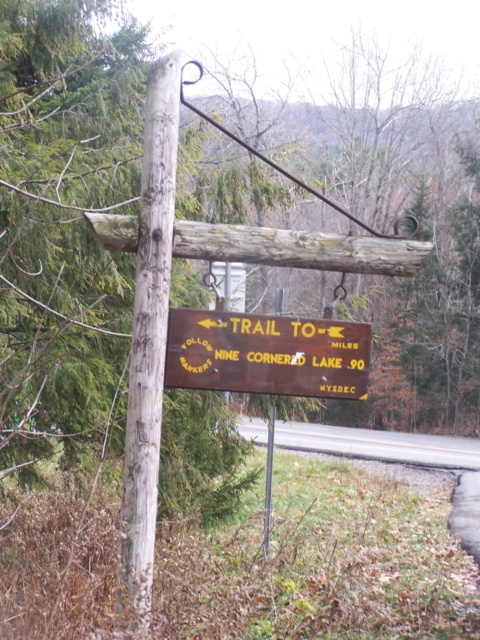
Question: Is weathered wood pole at center above brown wooden sign at center?

Choices:
 (A) yes
 (B) no

Answer: (A)

Question: Which object appears closest to the camera in this image?

Choices:
 (A) weathered wood pole at center
 (B) brown wooden sign at center

Answer: (A)

Question: Which of the following is the closest to the observer?

Choices:
 (A) brown wooden sign at center
 (B) weathered wood pole at center

Answer: (B)

Question: Is weathered wood pole at center wider than brown wooden sign at center?

Choices:
 (A) no
 (B) yes

Answer: (A)

Question: Is the position of weathered wood pole at center less distant than that of brown wooden sign at center?

Choices:
 (A) yes
 (B) no

Answer: (A)

Question: Among these objects, which one is nearest to the camera?

Choices:
 (A) weathered wood pole at center
 (B) brown wooden sign at center

Answer: (A)